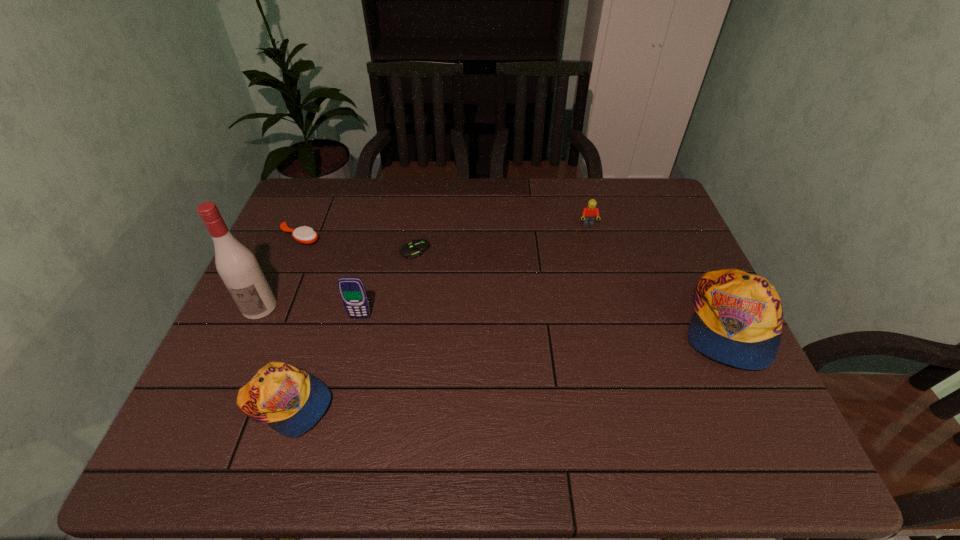
The height and width of the screenshot is (540, 960). What are the coordinates of `the shorter cap` in the screenshot? It's located at (290, 400).

What are the coordinates of `the rightmost object` in the screenshot? It's located at (738, 320).

Where is `the right cap`? the right cap is located at coordinates (738, 320).

At what (x,y) coordinates should I click in order to perform the action: click on the shortest object. Please return your answer as a coordinate pair (x, y). The width and height of the screenshot is (960, 540). Looking at the image, I should click on (417, 247).

Find the location of `computer mouse`. computer mouse is located at coordinates (417, 247).

You are a GUI agent. You are given a task and a screenshot of the screen. Output one action in this format:
    pyautogui.click(x=<x>, y=<y>)
    Task: Click on the second shortest object
    This screenshot has width=960, height=540.
    Given the screenshot: What is the action you would take?
    pyautogui.click(x=306, y=235)

This screenshot has width=960, height=540. Identify the location of the second object from right to left. (590, 213).

You are a GUI agent. You are given a task and a screenshot of the screen. Output one action in this format:
    pyautogui.click(x=<x>, y=<y>)
    Task: Click on the alcohol
    
    Given the screenshot: What is the action you would take?
    pyautogui.click(x=237, y=266)

Where is `cellular telephone`? The image size is (960, 540). cellular telephone is located at coordinates (352, 290).

Identify the location of free space located on the bill of the shorter cap. The image size is (960, 540). (420, 403).